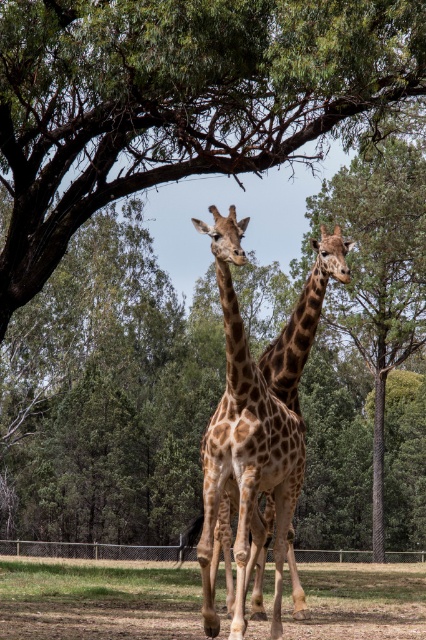
Question: Is green leafy tree at upper center bigger than spotted brown giraffe at center?

Choices:
 (A) yes
 (B) no

Answer: (A)

Question: Among these objects, which one is nearest to the camera?

Choices:
 (A) brown dirt field at lower center
 (B) spotted brown giraffe at center

Answer: (B)

Question: Does brown dirt field at lower center appear under spotted brown giraffe at center?

Choices:
 (A) no
 (B) yes

Answer: (B)

Question: Which of these objects is positioned closest to the brown dirt field at lower center?

Choices:
 (A) green leafy tree at upper center
 (B) spotted brown giraffe at center

Answer: (B)

Question: Which point is closer to the camera?

Choices:
 (A) green leafy tree at upper center
 (B) spotted brown giraffe at center

Answer: (B)

Question: Is brown dirt field at lower center wider than spotted brown giraffe at center?

Choices:
 (A) yes
 (B) no

Answer: (A)